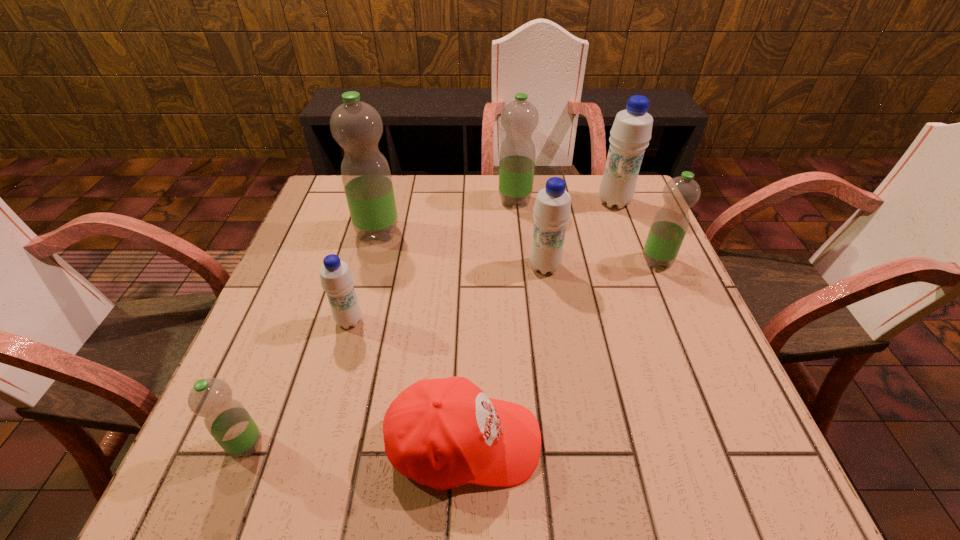
Locate an element on the screen. the sixth nearest object is located at coordinates (356, 126).

Locate an element on the screen. The height and width of the screenshot is (540, 960). the third nearest green water bottle is located at coordinates (356, 126).

Find the location of a particular element. Image resolution: width=960 pixels, height=540 pixels. the second green water bottle from right to left is located at coordinates (519, 118).

You are a GUI agent. You are given a task and a screenshot of the screen. Output one action in this format:
    pyautogui.click(x=<x>, y=<y>)
    Task: Click on the third smallest green water bottle
    This screenshot has height=540, width=960.
    Given the screenshot: What is the action you would take?
    pyautogui.click(x=519, y=118)

Identify the location of the biggest blue water bottle. (631, 132).

Identify the location of the farthest blue water bottle. (631, 132).

Where is `the second biggest blue water bottle`? The width and height of the screenshot is (960, 540). the second biggest blue water bottle is located at coordinates (552, 209).

Locate an element on the screen. the second farthest blue water bottle is located at coordinates (552, 209).

Where is `the third biggest green water bottle`? This screenshot has width=960, height=540. the third biggest green water bottle is located at coordinates (669, 226).

This screenshot has height=540, width=960. Identify the location of the third farthest green water bottle. (669, 226).